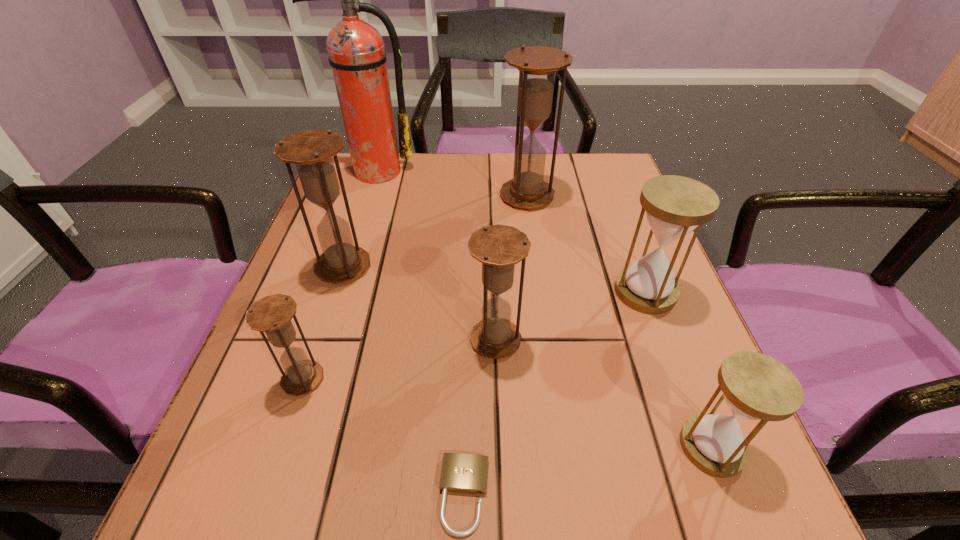
Locate an element on the screen. vacant area that lies between the third nearest hourglass and the fire extinguisher is located at coordinates (435, 255).

You are a GUI agent. You are given a task and a screenshot of the screen. Output one action in this format:
    pyautogui.click(x=<x>, y=<y>)
    Task: Click on the vacant region between the farthest brown hourglass and the bigger white hourglass
    Image resolution: width=960 pixels, height=540 pixels.
    Given the screenshot: What is the action you would take?
    pyautogui.click(x=587, y=244)

This screenshot has height=540, width=960. I want to click on unoccupied position between the fifth shortest hourglass and the fire extinguisher, so click(x=359, y=219).

Identify the location of the fourth closest object relative to the bigger white hourglass. (463, 473).

Where is `object that ranks as the closest to the tallest object`? This screenshot has height=540, width=960. object that ranks as the closest to the tallest object is located at coordinates (537, 66).

Locate an element on the screen. The width and height of the screenshot is (960, 540). the fourth closest hourglass to the tallest hourglass is located at coordinates (272, 314).

In order to click on hourglass that stands as the closest to the nearest hourglass in this screenshot , I will do `click(675, 205)`.

Identify which brown hourglass is located as the fourth nearest to the nearer white hourglass. Please provide its 2D coordinates. Your answer should be formatted as a tuple, i.e. [(x, y)], where the tuple contains the x and y coordinates of a point satisfying the conditions above.

[(311, 151)]

Select which brown hourglass is the closest to the nearest brown hourglass. Please provide its 2D coordinates. Your answer should be formatted as a tuple, i.e. [(x, y)], where the tuple contains the x and y coordinates of a point satisfying the conditions above.

[(311, 151)]

What are the coordinates of `free space that satisfies the following two spatial constraints: 1. at the nozzle of the tallest object; 2. on the left side of the smaller white hourglass` in the screenshot? It's located at (285, 447).